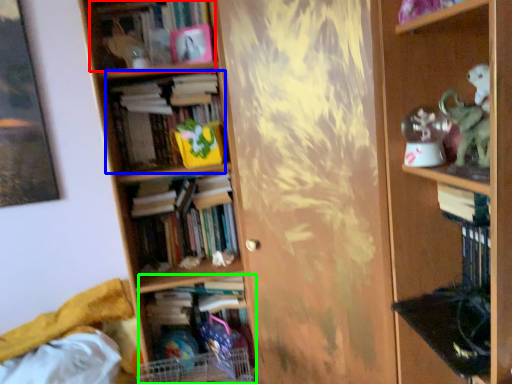
Question: Estimate the real-world distances between objects in this image. Which object is closer to book (highlighted by a red box), book (highlighted by a blue box) or book (highlighted by a green box)?

Choices:
 (A) book
 (B) book

Answer: (A)